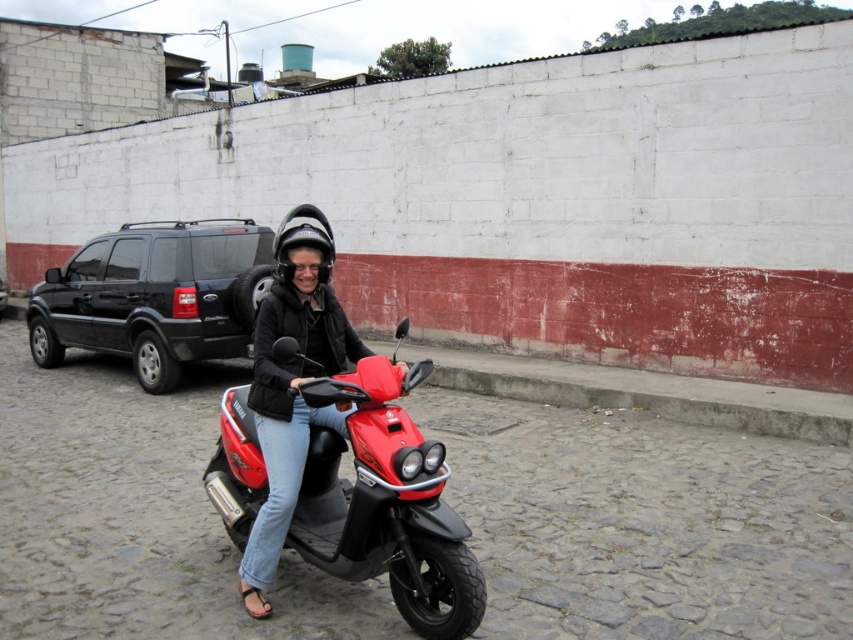
You are a delivery person who needs to park your scooter between the black matte suv at left and the matte black helmet at upper center. Can you fit your scooter there?

The black matte suv at left is wider than the matte black helmet at upper center, so the space between them may be sufficient to park your scooter. However, without knowing the exact width of the scooter, it is difficult to determine if it will fit perfectly.

You are a delivery driver who needs to park your shiny red scooter at center near the black matte suv at left. Can you park the scooter to the right of the suv without crossing the curb?

The shiny red scooter at center is already positioned on the right side of the black matte suv at left, so you can park it there without crossing the curb.

You are a delivery person needing to park your scooter. The black matte suv at left is blocking the parking spot. Can you safely maneuver around it to park your scooter? Please consider the distance between the suv and the camera.

The distance between the black matte suv at left and the camera is 8.15 meters. Since the suv is parked at the curb, you have enough space to safely maneuver around it to park your scooter.